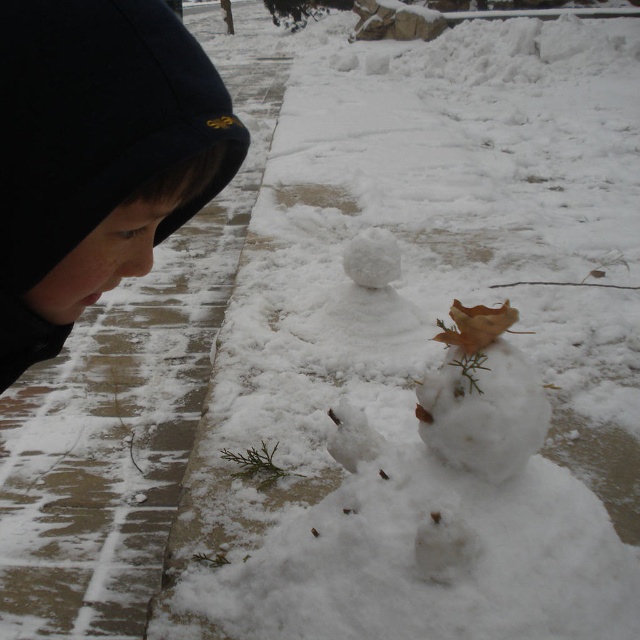
You are standing at the origin point in the image. The snowman is located at the center. Which direction should you move to reach the black fleece at upper left?

The black fleece at upper left is located at coordinates point (x=97, y=156), so you should move towards the upper left direction to reach it.